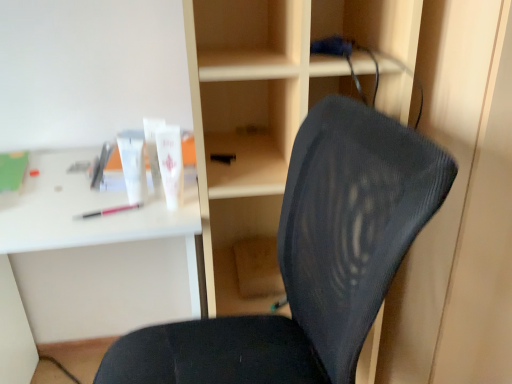
Identify the location of free location to the left of white glossy tube at upper center, positioned as the second toiletry in left-to-right order. Image resolution: width=512 pixels, height=384 pixels. 88,201.